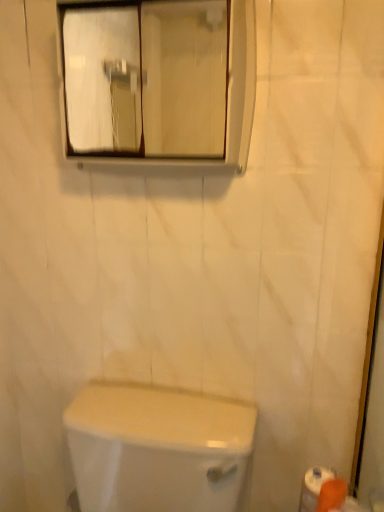
What do you see at coordinates (321, 490) in the screenshot? The image size is (384, 512). I see `orange matte toilet paper at lower right` at bounding box center [321, 490].

Image resolution: width=384 pixels, height=512 pixels. What are the coordinates of `white glossy toilet at lower center` in the screenshot? It's located at (157, 448).

Which is less distant, (338, 488) or (163, 410)?

Point (338, 488) is positioned closer to the camera compared to point (163, 410).

Based on their positions, is orange matte toilet paper at lower right located to the left or right of white glossy toilet at lower center?

orange matte toilet paper at lower right is to the right of white glossy toilet at lower center.

Looking at this image, measure the distance between orange matte toilet paper at lower right and white glossy toilet at lower center.

orange matte toilet paper at lower right is 40.51 centimeters away from white glossy toilet at lower center.

How many degrees apart are the facing directions of orange matte toilet paper at lower right and white glossy toilet at lower center?

There is a 54.4-degree angle between the facing directions of orange matte toilet paper at lower right and white glossy toilet at lower center.

Considering the points (214, 481) and (300, 503), which point is in front, point (214, 481) or point (300, 503)?

The point (214, 481) is closer.

Looking at this image, between white glossy toilet at lower center and orange matte toilet paper at lower right, which one has smaller width?

With smaller width is orange matte toilet paper at lower right.

From the picture: Would you say white glossy toilet at lower center is inside or outside orange matte toilet paper at lower right?

white glossy toilet at lower center lies outside orange matte toilet paper at lower right.

Is white glossy toilet at lower center positioned with its back to orange matte toilet paper at lower right?

No.

Is clear glass mirror at upper center beside orange matte toilet paper at lower right?

clear glass mirror at upper center and orange matte toilet paper at lower right are clearly separated.

Considering the sizes of objects clear glass mirror at upper center and orange matte toilet paper at lower right in the image provided, who is thinner, clear glass mirror at upper center or orange matte toilet paper at lower right?

With smaller width is orange matte toilet paper at lower right.

From a real-world perspective, who is located higher, clear glass mirror at upper center or orange matte toilet paper at lower right?

In real-world perspective, clear glass mirror at upper center is above.

Which object is positioned more to the right, clear glass mirror at upper center or orange matte toilet paper at lower right?

orange matte toilet paper at lower right is more to the right.

Looking at the image, does white glossy toilet at lower center seem bigger or smaller compared to clear glass mirror at upper center?

In the image, white glossy toilet at lower center appears to be larger than clear glass mirror at upper center.

From the image's perspective, is white glossy toilet at lower center on clear glass mirror at upper center?

No, from the image's perspective, white glossy toilet at lower center is not over clear glass mirror at upper center.

Is point (108, 429) closer or farther from the camera than point (83, 78)?

Point (108, 429) appears to be closer to the viewer than point (83, 78).

Can you confirm if white glossy toilet at lower center is thinner than clear glass mirror at upper center?

In fact, white glossy toilet at lower center might be wider than clear glass mirror at upper center.

Is clear glass mirror at upper center surrounded by orange matte toilet paper at lower right?

Definitely not — clear glass mirror at upper center is not inside orange matte toilet paper at lower right.

From the image's perspective, between orange matte toilet paper at lower right and clear glass mirror at upper center, who is located below?

orange matte toilet paper at lower right.

Can you confirm if orange matte toilet paper at lower right is smaller than clear glass mirror at upper center?

Yes.

Looking at their sizes, would you say orange matte toilet paper at lower right is wider or thinner than clear glass mirror at upper center?

Considering their sizes, orange matte toilet paper at lower right looks slimmer than clear glass mirror at upper center.

From a real-world perspective, between clear glass mirror at upper center and white glossy toilet at lower center, who is vertically higher?

clear glass mirror at upper center is physically above.

From the image's perspective, is clear glass mirror at upper center above or below white glossy toilet at lower center?

clear glass mirror at upper center is situated higher than white glossy toilet at lower center in the image.

Considering the relative sizes of clear glass mirror at upper center and white glossy toilet at lower center in the image provided, is clear glass mirror at upper center wider than white glossy toilet at lower center?

In fact, clear glass mirror at upper center might be narrower than white glossy toilet at lower center.

Identify the location of toilet paper on the right of white glossy toilet at lower center. The height and width of the screenshot is (512, 384). (321, 490).

The width and height of the screenshot is (384, 512). I want to click on toilet beneath the orange matte toilet paper at lower right (from a real-world perspective), so click(157, 448).

From the picture: Considering their positions, is white glossy toilet at lower center positioned further to clear glass mirror at upper center than orange matte toilet paper at lower right?

The object further to clear glass mirror at upper center is orange matte toilet paper at lower right.

When comparing their distances from clear glass mirror at upper center, does orange matte toilet paper at lower right or white glossy toilet at lower center seem further?

Based on the image, orange matte toilet paper at lower right appears to be further to clear glass mirror at upper center.

Which object lies nearer to the anchor point white glossy toilet at lower center, orange matte toilet paper at lower right or clear glass mirror at upper center?

orange matte toilet paper at lower right is closer to white glossy toilet at lower center.

Estimate the real-world distances between objects in this image. Which object is closer to orange matte toilet paper at lower right, white glossy toilet at lower center or clear glass mirror at upper center?

Based on the image, white glossy toilet at lower center appears to be nearer to orange matte toilet paper at lower right.

Which object lies further to the anchor point orange matte toilet paper at lower right, clear glass mirror at upper center or white glossy toilet at lower center?

clear glass mirror at upper center is positioned further to the anchor orange matte toilet paper at lower right.

Estimate the real-world distances between objects in this image. Which object is further from white glossy toilet at lower center, clear glass mirror at upper center or orange matte toilet paper at lower right?

clear glass mirror at upper center is further to white glossy toilet at lower center.

You are a GUI agent. You are given a task and a screenshot of the screen. Output one action in this format:
    pyautogui.click(x=<x>, y=<y>)
    Task: Click on the toilet paper between clear glass mirror at upper center and white glossy toilet at lower center in the up-down direction
    This screenshot has width=384, height=512.
    Given the screenshot: What is the action you would take?
    pyautogui.click(x=321, y=490)